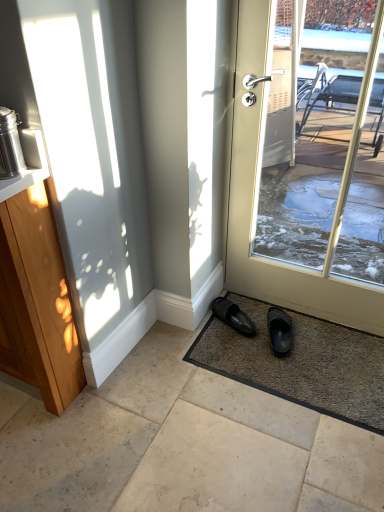
Question: Does stainless steel thermos at left appear on the right side of matte white door at center?

Choices:
 (A) no
 (B) yes

Answer: (A)

Question: From a real-world perspective, is stainless steel thermos at left under matte white door at center?

Choices:
 (A) no
 (B) yes

Answer: (A)

Question: Is stainless steel thermos at left with matte white door at center?

Choices:
 (A) no
 (B) yes

Answer: (A)

Question: Does stainless steel thermos at left have a greater height compared to matte white door at center?

Choices:
 (A) yes
 (B) no

Answer: (B)

Question: Does stainless steel thermos at left have a greater width compared to matte white door at center?

Choices:
 (A) no
 (B) yes

Answer: (B)

Question: Considering the positions of point (367, 425) and point (1, 169), is point (367, 425) closer or farther from the camera than point (1, 169)?

Choices:
 (A) closer
 (B) farther

Answer: (B)

Question: Based on their positions, is brown textured mat at lower center located to the left or right of stainless steel thermos at left?

Choices:
 (A) left
 (B) right

Answer: (B)

Question: From the image's perspective, is brown textured mat at lower center located above or below stainless steel thermos at left?

Choices:
 (A) above
 (B) below

Answer: (B)

Question: Is brown textured mat at lower center taller or shorter than stainless steel thermos at left?

Choices:
 (A) tall
 (B) short

Answer: (B)

Question: Relative to matte white door at center, is wooden cabinet at left in front or behind?

Choices:
 (A) front
 (B) behind

Answer: (A)

Question: Considering the positions of wooden cabinet at left and matte white door at center in the image, is wooden cabinet at left bigger or smaller than matte white door at center?

Choices:
 (A) small
 (B) big

Answer: (B)

Question: Is point coord(84,285) closer or farther from the camera than point coord(349,320)?

Choices:
 (A) farther
 (B) closer

Answer: (B)

Question: From a real-world perspective, is wooden cabinet at left above or below matte white door at center?

Choices:
 (A) above
 (B) below

Answer: (B)

Question: From the image's perspective, relative to black rubber slipper at lower center, marked as the first footwear in a left-to-right arrangement, is smooth beige tiles at center above or below?

Choices:
 (A) above
 (B) below

Answer: (B)

Question: Do you think smooth beige tiles at center is within black rubber slipper at lower center, marked as the first footwear in a left-to-right arrangement, or outside of it?

Choices:
 (A) outside
 (B) inside

Answer: (A)